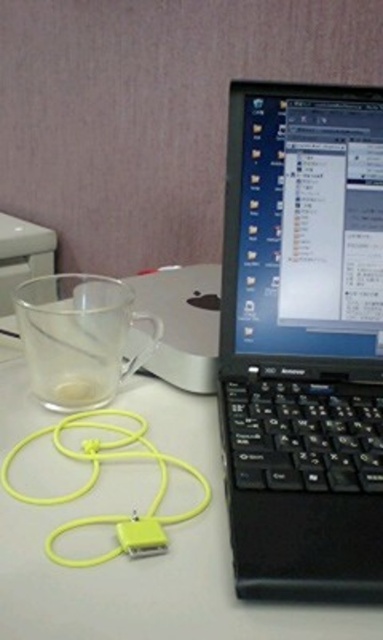
Is black plastic laptop at center to the right of transparent glass at upper left from the viewer's perspective?

Indeed, black plastic laptop at center is positioned on the right side of transparent glass at upper left.

The height and width of the screenshot is (640, 383). Find the location of `black plastic laptop at center`. black plastic laptop at center is located at coordinates (301, 344).

Is point (238, 449) positioned behind point (26, 458)?

That is False.

The width and height of the screenshot is (383, 640). I want to click on black plastic laptop at center, so click(x=301, y=344).

Is black plastic laptop at center shorter than transparent glass cup at left?

No.

Which is below, black plastic laptop at center or transparent glass cup at left?

transparent glass cup at left

Is point (260, 355) positioned after point (150, 340)?

No.

Identify the location of black plastic laptop at center. (301, 344).

Between point (24, 509) and point (116, 330), which one is positioned behind?

Point (116, 330)

Is transparent glass at upper left to the right of transparent glass cup at left from the viewer's perspective?

Correct, you'll find transparent glass at upper left to the right of transparent glass cup at left.

Identify the location of transparent glass at upper left. The width and height of the screenshot is (383, 640). (140, 557).